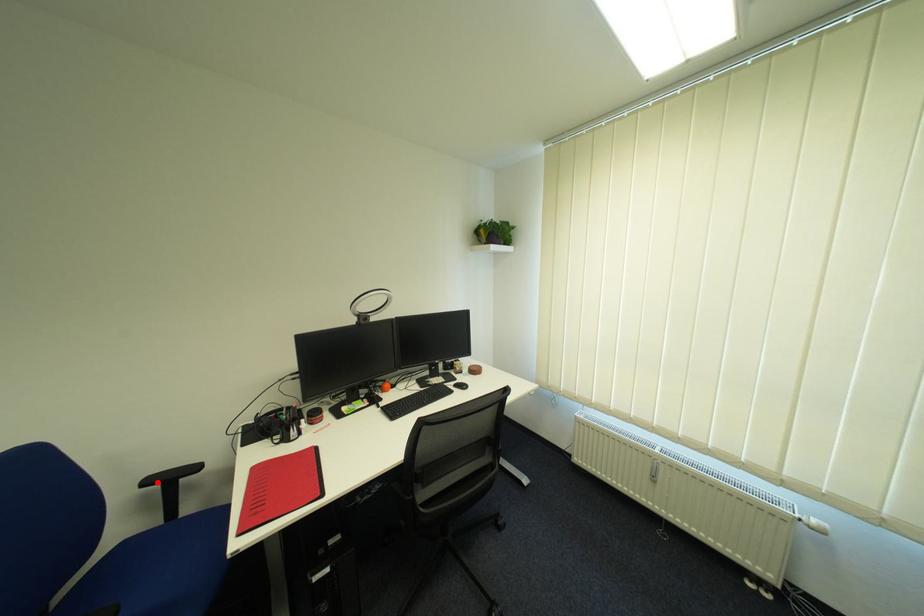
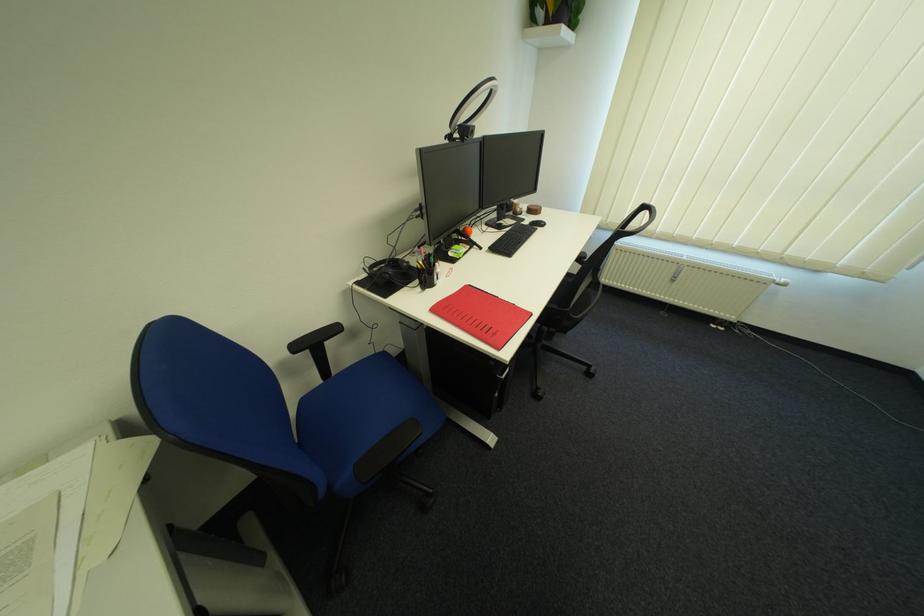
Where in the second image is the point corresponding to the highlighted location from the first image?

(306, 349)